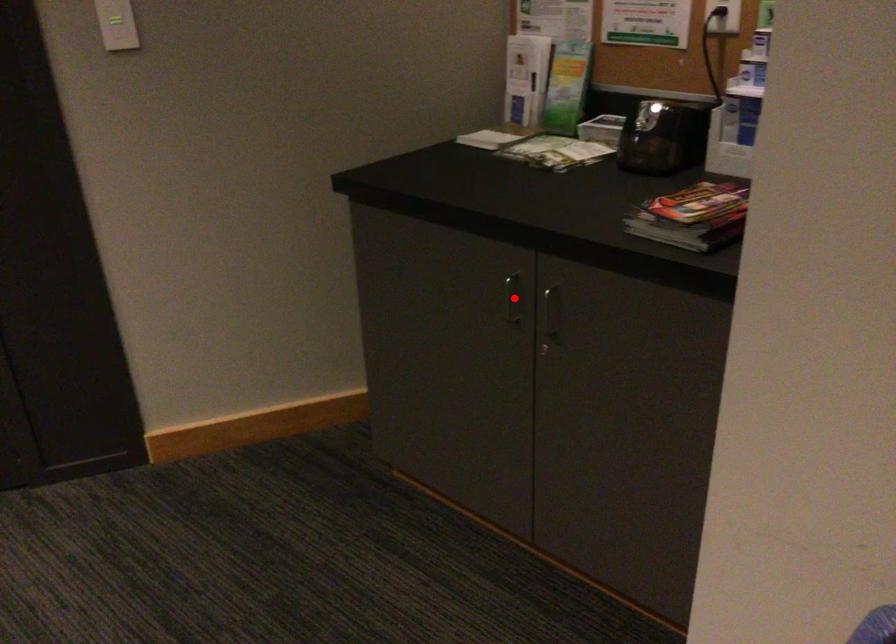
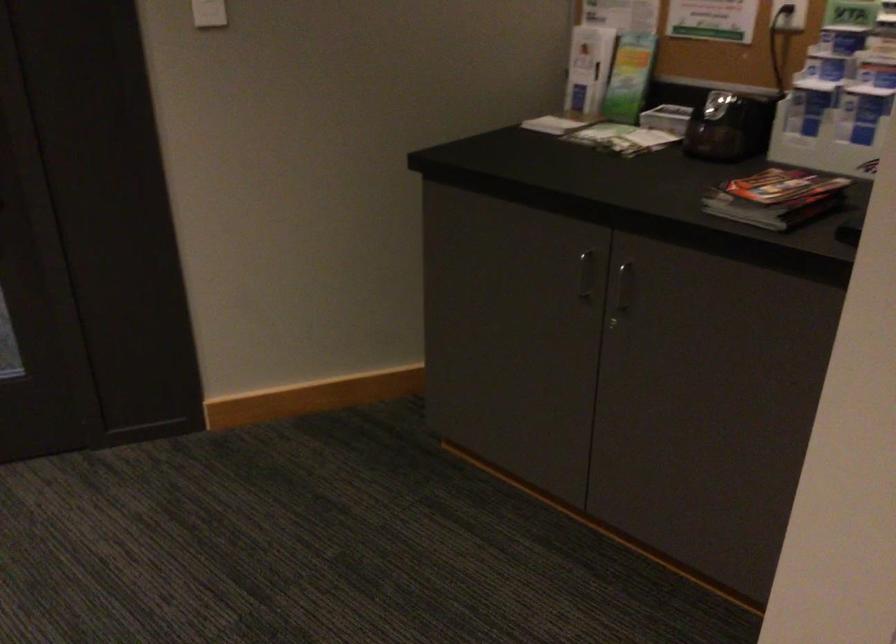
Question: I am providing you with two images of the same scene from different viewpoints. A red point is marked on the first image. Is the red point's position out of view in image 2?

Choices:
 (A) Yes
 (B) No

Answer: (B)